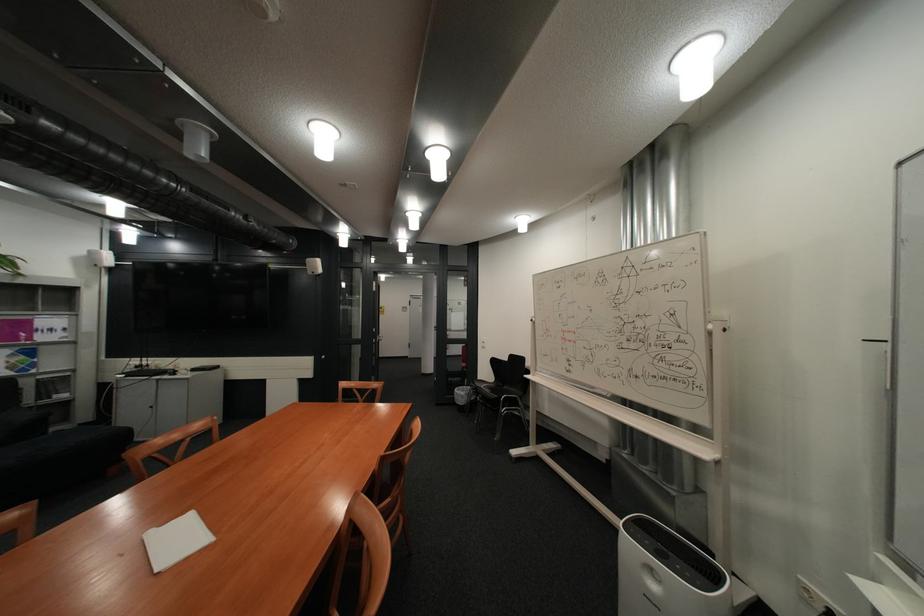
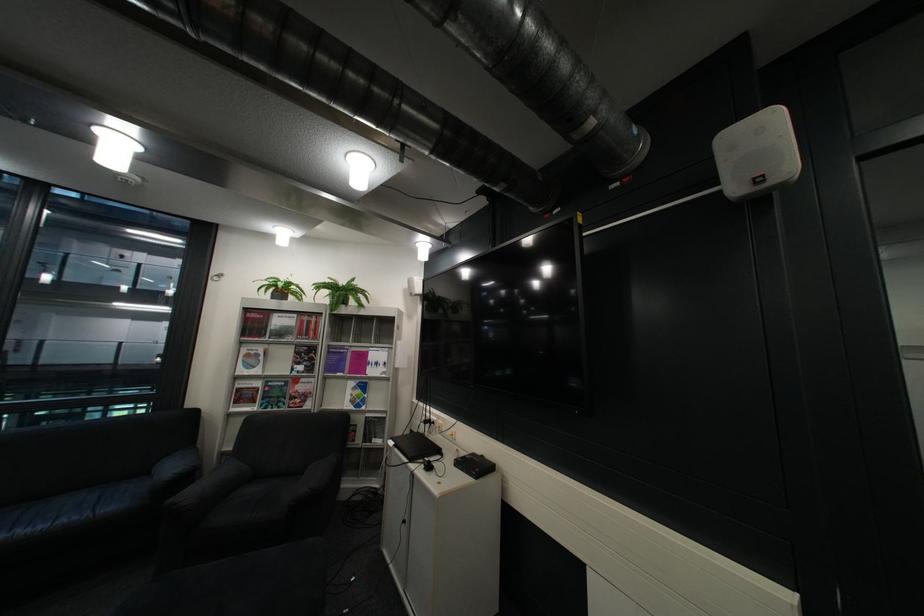
The point at (111, 265) is marked in the first image. Where is the corresponding point in the second image?

(427, 294)